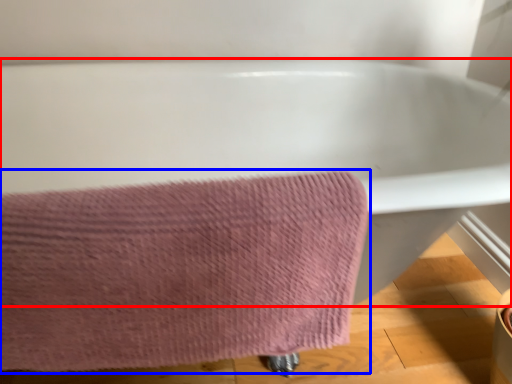
Question: Which point is further to the camera, bathtub (highlighted by a red box) or towel (highlighted by a blue box)?

Choices:
 (A) bathtub
 (B) towel

Answer: (B)